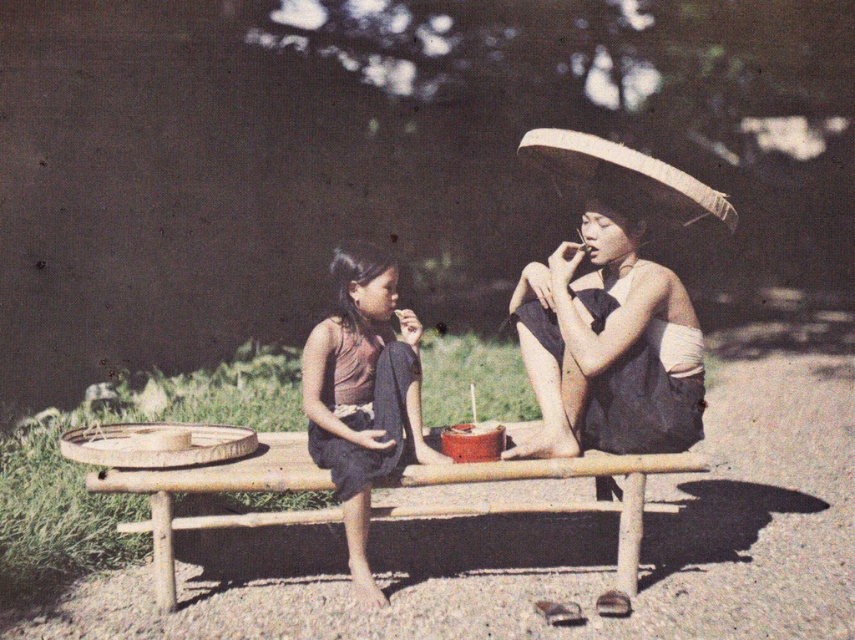
Question: Which of the following is the closest to the observer?

Choices:
 (A) brown matte dress at center
 (B) matte black dress at right
 (C) wooden picnic table at center
 (D) natural straw hat at upper right

Answer: (D)

Question: Which of these objects is positioned farthest from the matte black dress at right?

Choices:
 (A) brown matte dress at center
 (B) natural straw hat at upper right
 (C) wooden picnic table at center

Answer: (B)

Question: Among these objects, which one is farthest from the camera?

Choices:
 (A) brown matte dress at center
 (B) wooden picnic table at center
 (C) natural straw hat at upper right
 (D) matte black dress at right

Answer: (D)

Question: From the image, what is the correct spatial relationship of matte black dress at right in relation to wooden picnic table at center?

Choices:
 (A) above
 (B) below

Answer: (A)

Question: Does wooden picnic table at center appear under brown matte dress at center?

Choices:
 (A) yes
 (B) no

Answer: (A)

Question: Does wooden picnic table at center have a smaller size compared to natural straw hat at upper right?

Choices:
 (A) yes
 (B) no

Answer: (A)